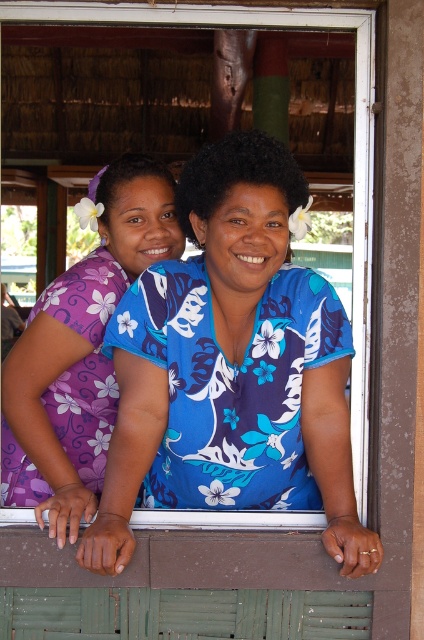
Is blue floral shirt at center taller than purple floral dress at left?

Indeed, blue floral shirt at center has a greater height compared to purple floral dress at left.

Measure the distance between blue floral shirt at center and purple floral dress at left.

A distance of 14.22 inches exists between blue floral shirt at center and purple floral dress at left.

Between point (281, 321) and point (27, 458), which one is positioned behind?

Point (27, 458)

Identify the location of blue floral shirt at center. (231, 368).